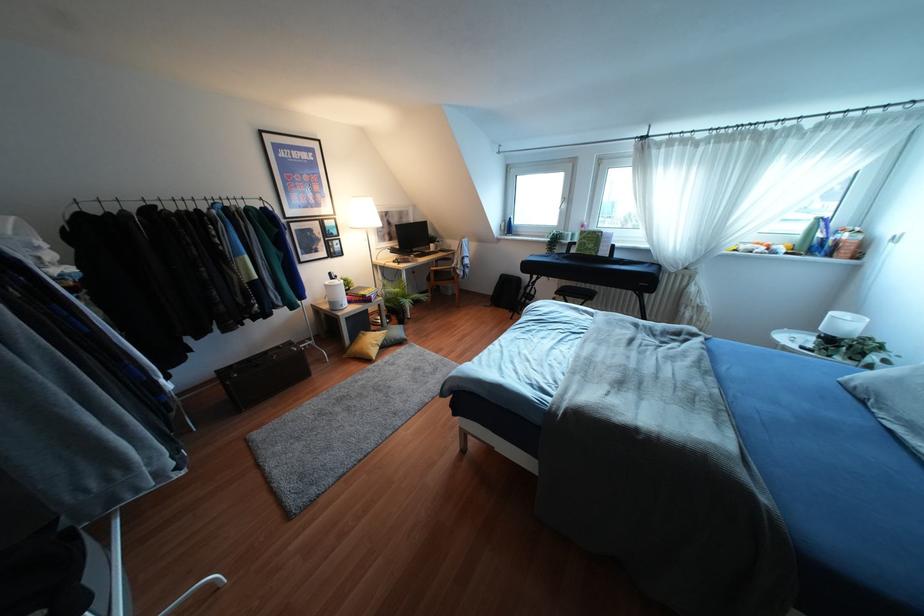
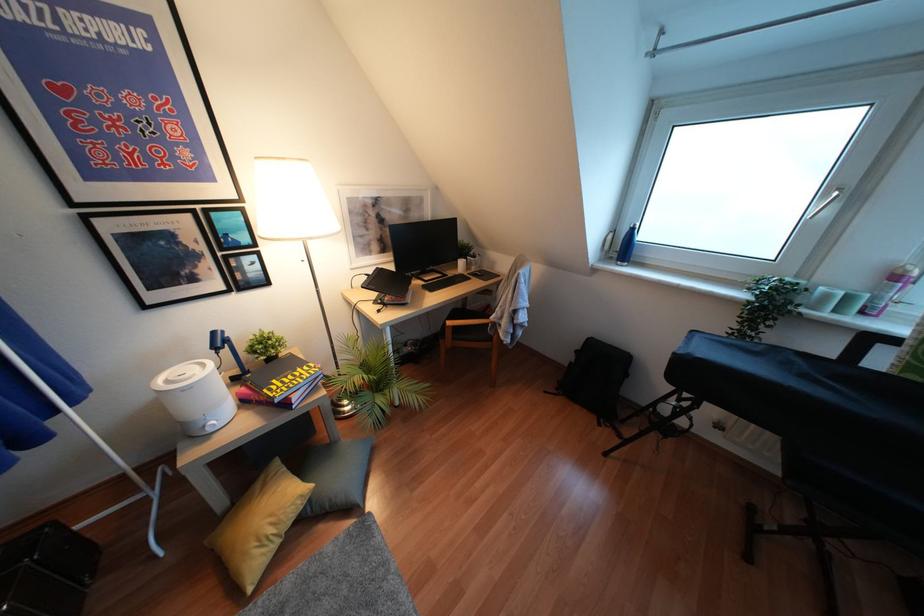
Question: Which direction would the cameraman need to move to produce the second image? Reply with the corresponding letter.

Choices:
 (A) Left
 (B) Right
 (C) Forward
 (D) Backward

Answer: (C)